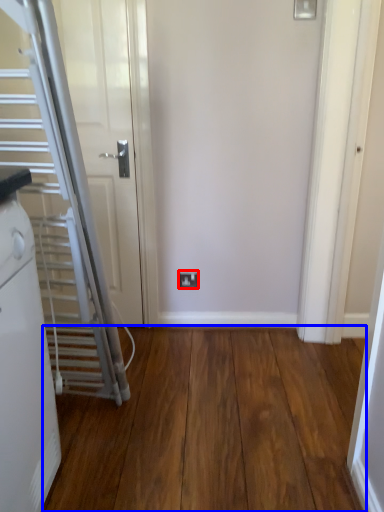
Question: Which object is further to the camera taking this photo, electric outlet (highlighted by a red box) or corridor (highlighted by a blue box)?

Choices:
 (A) electric outlet
 (B) corridor

Answer: (A)